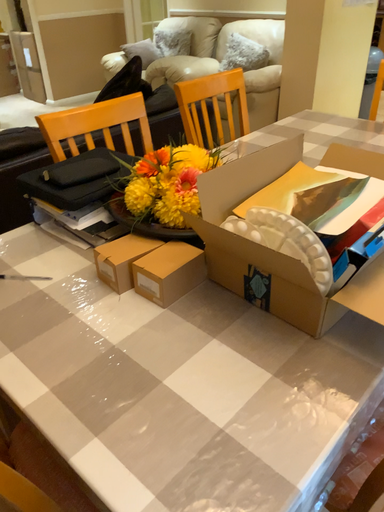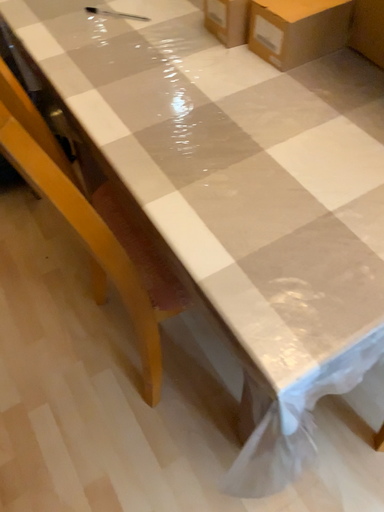
Question: How did the camera likely rotate when shooting the video?

Choices:
 (A) rotated downward
 (B) rotated upward

Answer: (A)